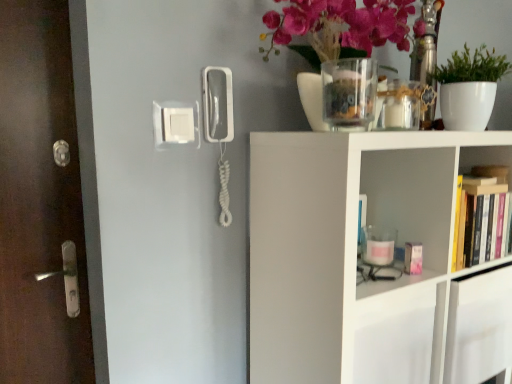
You are a GUI agent. You are given a task and a screenshot of the screen. Output one action in this format:
    pyautogui.click(x=<x>, y=<y>)
    Task: Click on the hardcover books at right, the first shelf viewed from the top
    
    Given the screenshot: What is the action you would take?
    pyautogui.click(x=486, y=158)

What do you see at coordinates (39, 199) in the screenshot?
I see `brown wooden door at left` at bounding box center [39, 199].

You are a GUI agent. You are given a task and a screenshot of the screen. Output one action in this format:
    pyautogui.click(x=<x>, y=<y>)
    Task: Click on the brown wooden door at left
    
    Given the screenshot: What is the action you would take?
    pyautogui.click(x=39, y=199)

Measure the distance between point (x=233, y=123) and camera.

Point (x=233, y=123) is 1.20 meters from camera.

Describe the element at coordinates (470, 87) in the screenshot. I see `white matte plant at upper right` at that location.

Locate an element on the screen. The height and width of the screenshot is (384, 512). white matte shelf at upper right, the first shelf in the bottom-to-top sequence is located at coordinates (353, 252).

Where is `hardcover books at right, which is counted as the second shelf, starting from the bottom`? hardcover books at right, which is counted as the second shelf, starting from the bottom is located at coordinates (486, 158).

Between clear glass vase at upper center and hardcover books at right, which is counted as the second shelf, starting from the bottom, which one has less height?

Standing shorter between the two is clear glass vase at upper center.

In the scene shown: From the image's perspective, is clear glass vase at upper center located beneath hardcover books at right, which is counted as the second shelf, starting from the bottom?

Incorrect, from the image's perspective, clear glass vase at upper center is higher than hardcover books at right, which is counted as the second shelf, starting from the bottom.

Consider the image. Is clear glass vase at upper center bigger than hardcover books at right, the first shelf viewed from the top?

Actually, clear glass vase at upper center might be smaller than hardcover books at right, the first shelf viewed from the top.

Could you tell me if white plastic phone at center is turned towards clear glass vase at upper center?

No, white plastic phone at center is not aimed at clear glass vase at upper center.

Which of these two, white plastic phone at center or clear glass vase at upper center, stands shorter?

clear glass vase at upper center is shorter.

Which of these two, white plastic phone at center or clear glass vase at upper center, is bigger?

clear glass vase at upper center.

Considering the sizes of objects white plastic phone at center and clear glass vase at upper center in the image provided, who is wider, white plastic phone at center or clear glass vase at upper center?

Wider between the two is clear glass vase at upper center.

From the image's perspective, would you say white plastic light switch at upper center is positioned over clear glass vase at upper center?

No, from the image's perspective, white plastic light switch at upper center is not above clear glass vase at upper center.

Does white plastic light switch at upper center have a lesser width compared to clear glass vase at upper center?

Yes, white plastic light switch at upper center is thinner than clear glass vase at upper center.

From a real-world perspective, is white plastic light switch at upper center beneath clear glass vase at upper center?

Yes, from a real-world perspective, white plastic light switch at upper center is below clear glass vase at upper center.

Would you say brown wooden door at left is to the left or to the right of white plastic light switch at upper center in the picture?

brown wooden door at left is to the left of white plastic light switch at upper center.

From a real-world perspective, is brown wooden door at left physically below white plastic light switch at upper center?

Yes, from a real-world perspective, brown wooden door at left is beneath white plastic light switch at upper center.

Is the depth of brown wooden door at left greater than that of white plastic light switch at upper center?

No, brown wooden door at left is closer to the viewer.

Is clear glass vase at upper center behind white matte shelf at upper right, the first shelf in the bottom-to-top sequence?

Yes, the depth of clear glass vase at upper center is greater than that of white matte shelf at upper right, the first shelf in the bottom-to-top sequence.

From the picture: Does clear glass vase at upper center have a lesser height compared to white matte shelf at upper right, the 2th shelf when ordered from top to bottom?

Yes, clear glass vase at upper center is shorter than white matte shelf at upper right, the 2th shelf when ordered from top to bottom.

Consider the image. Is clear glass vase at upper center not near white matte shelf at upper right, the first shelf in the bottom-to-top sequence?

No, there isn't a large distance between clear glass vase at upper center and white matte shelf at upper right, the first shelf in the bottom-to-top sequence.

Considering the sizes of objects white matte plant at upper right and brown wooden door at left in the image provided, who is smaller, white matte plant at upper right or brown wooden door at left?

With smaller size is white matte plant at upper right.

Can you tell me how much white matte plant at upper right and brown wooden door at left differ in facing direction?

The angle between the facing direction of white matte plant at upper right and the facing direction of brown wooden door at left is 1.76 degrees.

Looking at this image, are white matte plant at upper right and brown wooden door at left far apart?

white matte plant at upper right is far away from brown wooden door at left.

Is white matte plant at upper right looking in the opposite direction of brown wooden door at left?

No, brown wooden door at left is not at the back of white matte plant at upper right.

Would you say white matte shelf at upper right, the 2th shelf when ordered from top to bottom, is to the left or to the right of matte glass vase at upper center in the picture?

From the image, it's evident that white matte shelf at upper right, the 2th shelf when ordered from top to bottom, is to the right of matte glass vase at upper center.

Could matte glass vase at upper center be considered to be inside white matte shelf at upper right, the first shelf in the bottom-to-top sequence?

No, white matte shelf at upper right, the first shelf in the bottom-to-top sequence, does not contain matte glass vase at upper center.

Between white matte shelf at upper right, the first shelf in the bottom-to-top sequence, and matte glass vase at upper center, which one has more height?

white matte shelf at upper right, the first shelf in the bottom-to-top sequence.

From a real-world perspective, is white matte shelf at upper right, the 2th shelf when ordered from top to bottom, physically located above or below matte glass vase at upper center?

Clearly, from a real-world perspective, white matte shelf at upper right, the 2th shelf when ordered from top to bottom, is below matte glass vase at upper center.

Identify the location of shelf that is the 1st one below the clear glass vase at upper center (from a real-world perspective). This screenshot has height=384, width=512. (486, 158).

Find the location of `vase above the white plastic phone at center (from a real-world perspective)`. vase above the white plastic phone at center (from a real-world perspective) is located at coordinates (349, 93).

Looking at the image, which one is located closer to white plastic light switch at upper center, hardcover books at right, the first shelf viewed from the top, or clear glass vase at upper center?

Based on the image, clear glass vase at upper center appears to be nearer to white plastic light switch at upper center.

Which object lies nearer to the anchor point white matte plant at upper right, white plastic light switch at upper center or brown wooden door at left?

white plastic light switch at upper center.

Considering their positions, is white matte plant at upper right positioned further to brown wooden door at left than white plastic phone at center?

white matte plant at upper right.

From the image, which object appears to be nearer to white plastic phone at center, clear glass vase at upper center or brown wooden door at left?

clear glass vase at upper center lies closer to white plastic phone at center than the other object.

Considering their positions, is hardcover books at right, the first shelf viewed from the top, positioned further to matte glass vase at upper center than white plastic phone at center?

hardcover books at right, the first shelf viewed from the top, lies further to matte glass vase at upper center than the other object.

In the scene shown: Based on their spatial positions, is white plastic light switch at upper center or white plastic phone at center closer to white matte plant at upper right?

Based on the image, white plastic phone at center appears to be nearer to white matte plant at upper right.

Considering their positions, is white matte shelf at upper right, the first shelf in the bottom-to-top sequence, positioned closer to white matte plant at upper right than white plastic phone at center?

Among the two, white matte shelf at upper right, the first shelf in the bottom-to-top sequence, is located nearer to white matte plant at upper right.

Considering their positions, is hardcover books at right, the first shelf viewed from the top, positioned further to white plastic phone at center than brown wooden door at left?

hardcover books at right, the first shelf viewed from the top.

You are a GUI agent. You are given a task and a screenshot of the screen. Output one action in this format:
    pyautogui.click(x=<x>, y=<y>)
    Task: Click on the corded phone between white plastic light switch at upper center and white matte shelf at upper right, the 2th shelf when ordered from top to bottom
    
    Given the screenshot: What is the action you would take?
    pyautogui.click(x=219, y=125)

Where is `vase between white plastic phone at center and white matte plant at upper right in the horizontal direction`? The image size is (512, 384). vase between white plastic phone at center and white matte plant at upper right in the horizontal direction is located at coordinates (349, 93).

At what (x,y) coordinates should I click in order to perform the action: click on corded phone between white plastic light switch at upper center and clear glass vase at upper center. Please return your answer as a coordinate pair (x, y). Looking at the image, I should click on [219, 125].

The height and width of the screenshot is (384, 512). I want to click on floral arrangement between brown wooden door at left and white matte plant at upper right in the horizontal direction, so click(x=338, y=28).